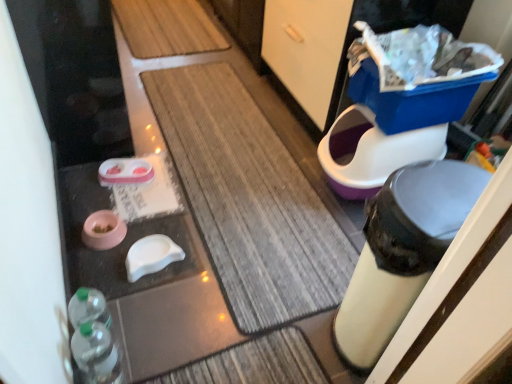
Question: From the image's perspective, is translucent plastic bottles at lower left located above or below blue plastic potty at right, the 2th potty from the left?

Choices:
 (A) below
 (B) above

Answer: (A)

Question: In the image, is translucent plastic bottles at lower left positioned in front of or behind blue plastic potty at right, the 2th potty when ordered from bottom to top?

Choices:
 (A) behind
 (B) front

Answer: (B)

Question: Which object is positioned farthest from the blue plastic potty at right, the 2th potty when ordered from bottom to top?

Choices:
 (A) translucent plastic bottles at lower left
 (B) matte black trash can at right
 (C) pink matte pet food bowl at lower left, arranged as the second potty when viewed from the top
 (D) matte white toilet bowl at right
 (E) textured brown bath mat at center

Answer: (A)

Question: Estimate the real-world distances between objects in this image. Which object is farther from the matte black trash can at right?

Choices:
 (A) blue plastic potty at right, which appears as the 1th potty when viewed from the right
 (B) translucent plastic bottles at lower left
 (C) pink matte pet food bowl at lower left, the first potty from the bottom
 (D) textured brown bath mat at center
 (E) matte white toilet bowl at right

Answer: (C)